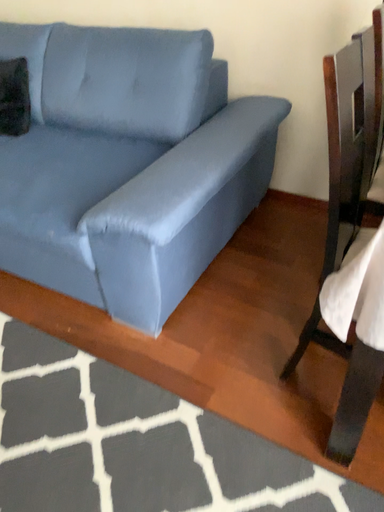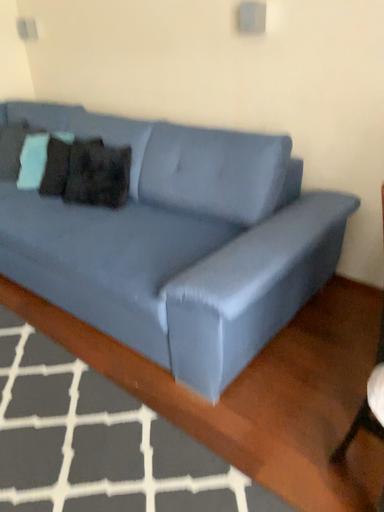
Question: How did the camera likely rotate when shooting the video?

Choices:
 (A) rotated left
 (B) rotated right

Answer: (A)